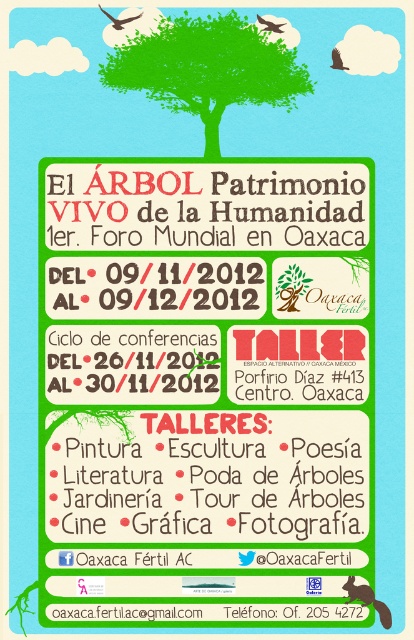
Question: Which of the following is the closest to the observer?

Choices:
 (A) (288, 77)
 (B) (187, 436)

Answer: (A)

Question: Is matte red text at center above green matte tree at upper center?

Choices:
 (A) yes
 (B) no

Answer: (B)

Question: Can you confirm if matte red text at center is bigger than green matte tree at upper center?

Choices:
 (A) no
 (B) yes

Answer: (B)

Question: Can you confirm if matte red text at center is positioned to the right of green matte tree at upper center?

Choices:
 (A) yes
 (B) no

Answer: (A)

Question: Which of the following is the closest to the observer?

Choices:
 (A) green matte tree at upper center
 (B) matte red text at center

Answer: (A)